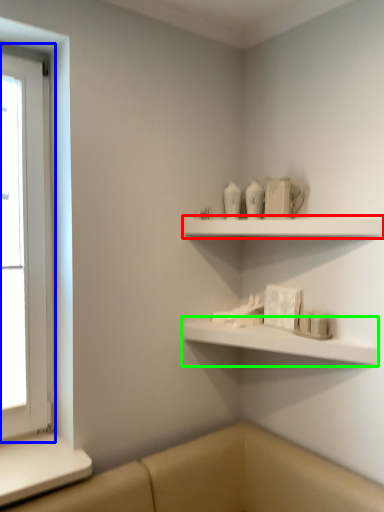
Question: Based on their relative distances, which object is nearer to shelf (highlighted by a red box)? Choose from window (highlighted by a blue box) and shelf (highlighted by a green box).

Choices:
 (A) window
 (B) shelf

Answer: (B)